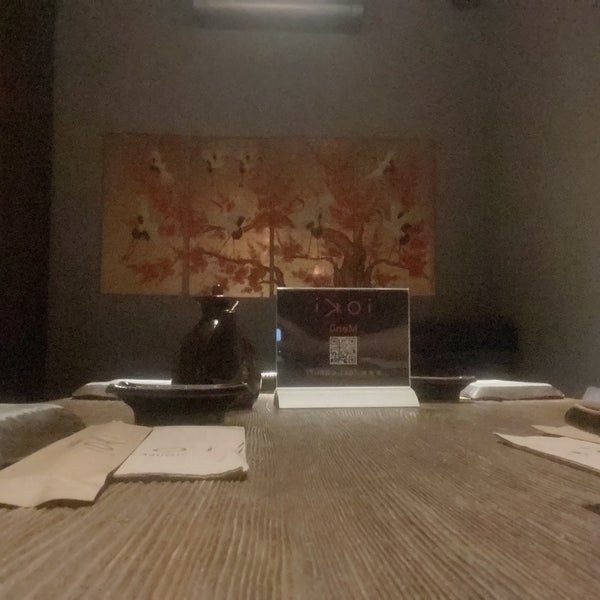
Find the location of a particular element. This screenshot has height=600, width=600. tabletop in front of menu is located at coordinates (348, 415).